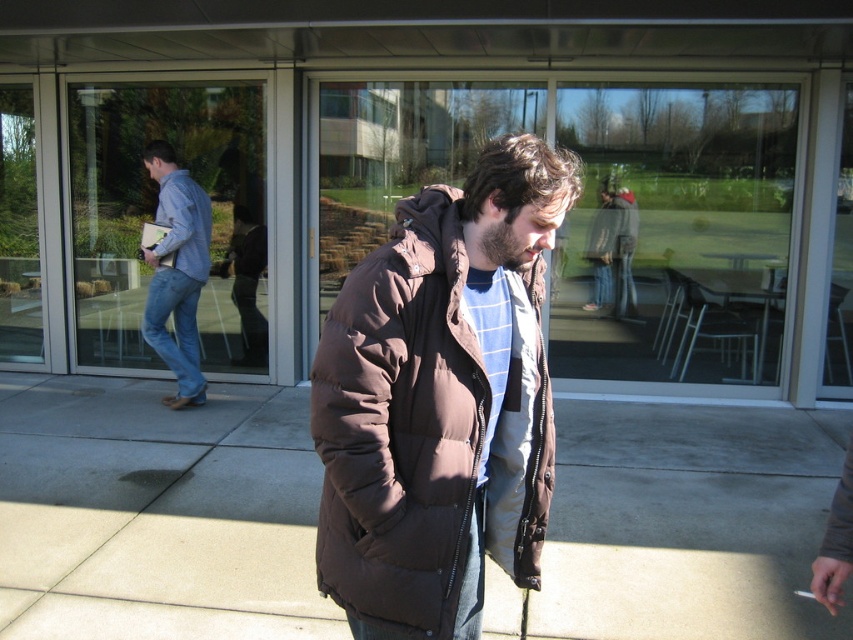
Who is lower down, brown fabric pavement at center or brown puffy jacket at center?

brown fabric pavement at center is lower down.

How distant is brown fabric pavement at center from brown puffy jacket at center?

They are 3.14 meters apart.

Locate an element on the screen. brown fabric pavement at center is located at coordinates (155, 513).

The height and width of the screenshot is (640, 853). Find the location of `brown fabric pavement at center`. brown fabric pavement at center is located at coordinates (155, 513).

Looking at this image, can you confirm if transparent glass door at center is taller than denim jeans at left?

Yes, transparent glass door at center is taller than denim jeans at left.

How distant is transparent glass door at center from denim jeans at left?

transparent glass door at center and denim jeans at left are 5.57 feet apart from each other.

Measure the distance between transparent glass door at center and camera.

A distance of 6.63 meters exists between transparent glass door at center and camera.

Locate an element on the screen. The height and width of the screenshot is (640, 853). transparent glass door at center is located at coordinates (154, 216).

Looking at this image, how far apart are brown fabric pavement at center and transparent glass door at center?

A distance of 9.38 feet exists between brown fabric pavement at center and transparent glass door at center.

Between brown fabric pavement at center and transparent glass door at center, which one appears on the right side from the viewer's perspective?

Positioned to the right is brown fabric pavement at center.

Is point (624, 420) positioned in front of point (207, 332)?

That is True.

The height and width of the screenshot is (640, 853). Find the location of `brown fabric pavement at center`. brown fabric pavement at center is located at coordinates (155, 513).